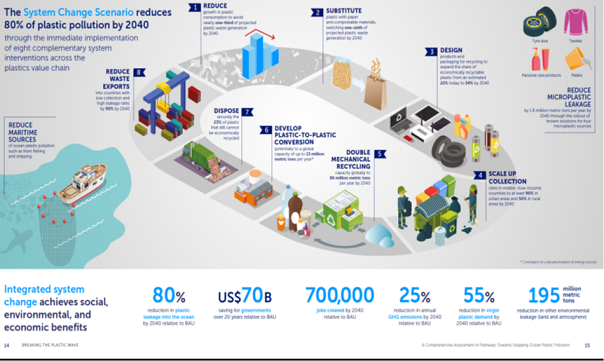
Locate an element on the screen. The height and width of the screenshot is (361, 604). plastic contaienrs is located at coordinates coord(295,204), coord(281,225), coord(303,229), coord(310,232), coord(304,213).